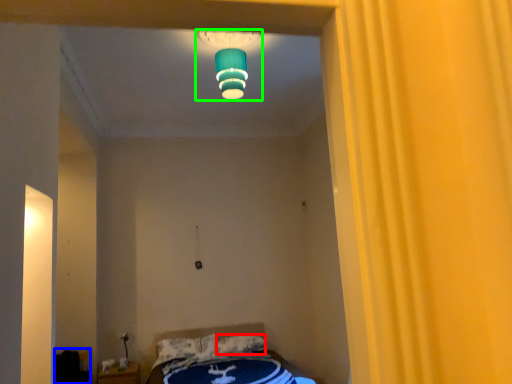
Question: Estimate the real-world distances between objects in this image. Which object is farther from pillow (highlighted by a red box), furniture (highlighted by a blue box) or lamp (highlighted by a green box)?

Choices:
 (A) furniture
 (B) lamp

Answer: (B)